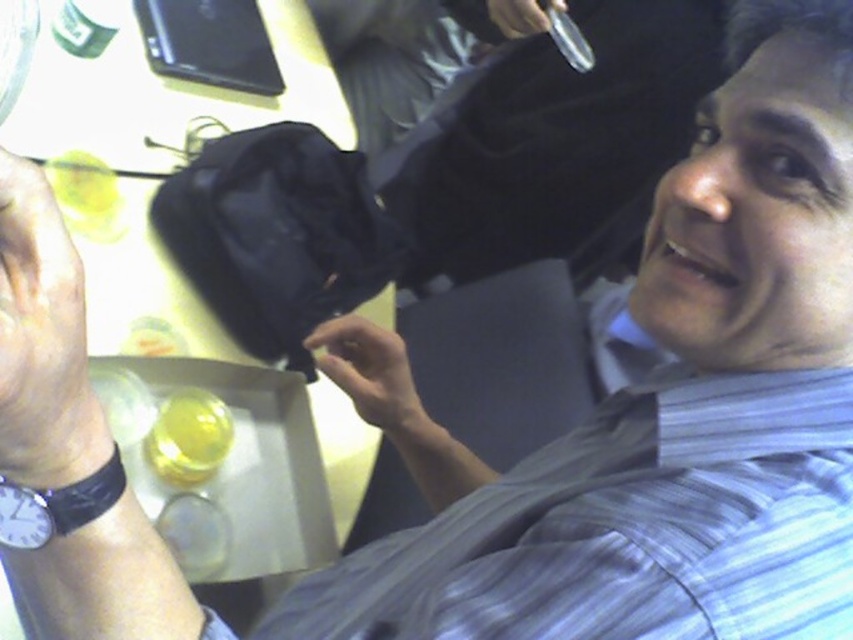
Which is behind, point (271, 488) or point (186, 436)?

The point (271, 488) is more distant.

How distant is white paper at center from translucent yellow liquid at center?

21.35 centimeters

Does point (277, 556) come farther from viewer compared to point (172, 403)?

Yes, it is behind point (172, 403).

Identify the location of white paper at center. The width and height of the screenshot is (853, 640). (181, 280).

This screenshot has width=853, height=640. What do you see at coordinates (181, 280) in the screenshot?
I see `white paper at center` at bounding box center [181, 280].

Identify the location of white paper at center. (181, 280).

At what (x,y) coordinates should I click in order to perform the action: click on white paper at center. Please return your answer as a coordinate pair (x, y). Image resolution: width=853 pixels, height=640 pixels. Looking at the image, I should click on (181, 280).

This screenshot has height=640, width=853. Find the location of `white paper at center`. white paper at center is located at coordinates (181, 280).

Is point (213, 451) positioned after point (498, 16)?

No.

Locate an element on the screen. translucent yellow liquid at center is located at coordinates (189, 436).